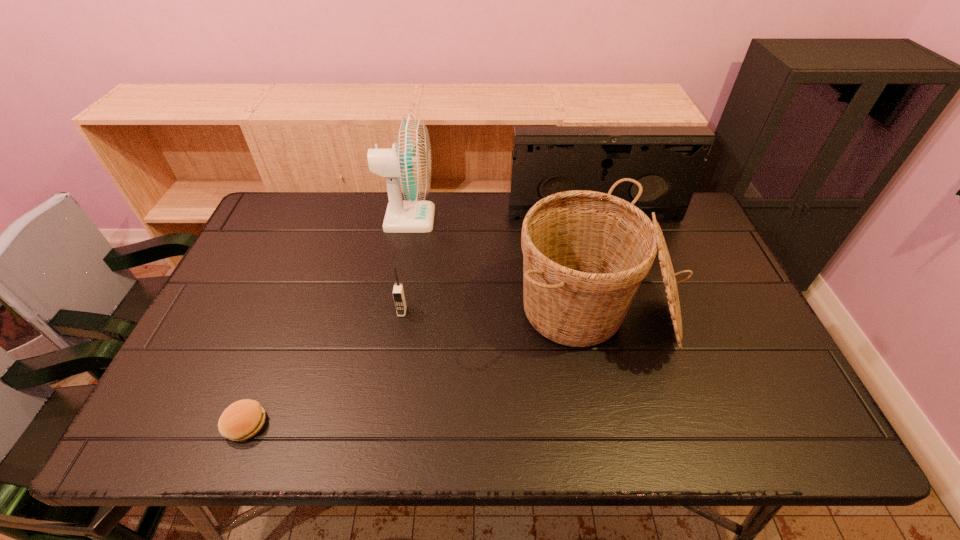
This screenshot has height=540, width=960. What are the coordinates of `fan` in the screenshot? It's located at (407, 168).

Where is `videotape`? This screenshot has width=960, height=540. videotape is located at coordinates (667, 161).

You are a GUI agent. You are given a task and a screenshot of the screen. Output one action in this format:
    pyautogui.click(x=<x>, y=<y>)
    Task: Click on the basket
    This screenshot has height=540, width=960.
    Given the screenshot: What is the action you would take?
    pyautogui.click(x=585, y=254)

Where is `cellular telephone`? The image size is (960, 540). cellular telephone is located at coordinates (398, 293).

Locate an element on the screen. This screenshot has width=960, height=540. the nearest object is located at coordinates (243, 419).

Where is `patty`? Image resolution: width=960 pixels, height=540 pixels. patty is located at coordinates (243, 419).

Locate an element on the screen. vacant space situated in front of the fan to face the airflow is located at coordinates (505, 219).

Where is `free space located on the front side of the videotape`? Image resolution: width=960 pixels, height=540 pixels. free space located on the front side of the videotape is located at coordinates coord(618,302).

Identify the location of vacant space located on the left of the basket. tap(393, 312).

This screenshot has height=540, width=960. Find the location of `vacant point located on the front-facing side of the cellular telephone`. vacant point located on the front-facing side of the cellular telephone is located at coordinates [x=390, y=389].